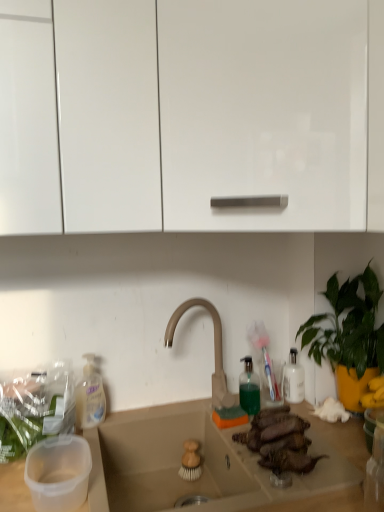
This screenshot has height=512, width=384. Identify the location of vacant area that lies to the right of transparent plastic soap dispenser at lower left, the 1th bottle viewed from the left. (142, 415).